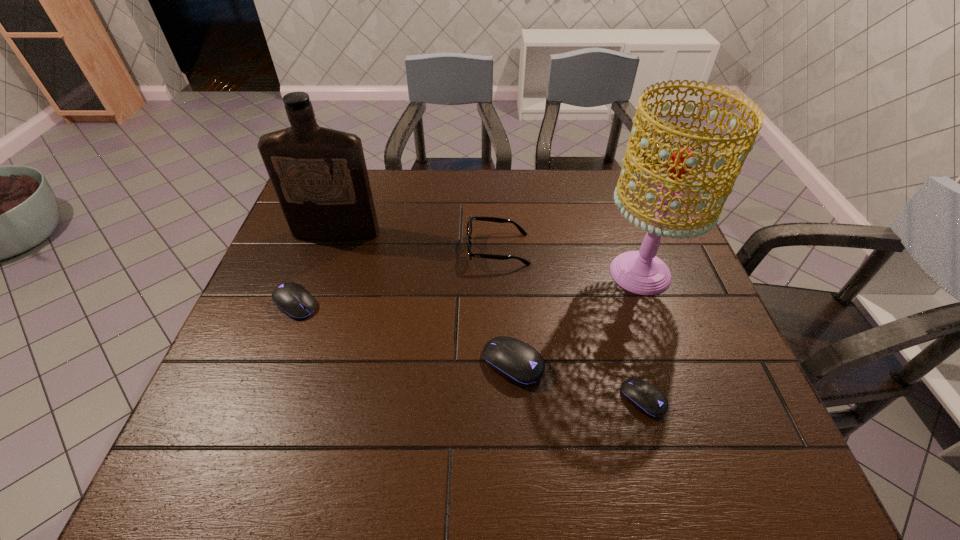
Where is `vacant space that satisfies the following two spatial constraints: 1. on the label side of the lampshade; 2. on the left side of the liquor`? vacant space that satisfies the following two spatial constraints: 1. on the label side of the lampshade; 2. on the left side of the liquor is located at coordinates (323, 273).

You are a GUI agent. You are given a task and a screenshot of the screen. Output one action in this format:
    pyautogui.click(x=<x>, y=<y>)
    Task: Click on the vacant area in the image that satisfies the following two spatial constraints: 1. on the label side of the shortest computer mouse; 2. on the left side of the liquor
    This screenshot has height=540, width=960.
    Given the screenshot: What is the action you would take?
    pyautogui.click(x=278, y=399)